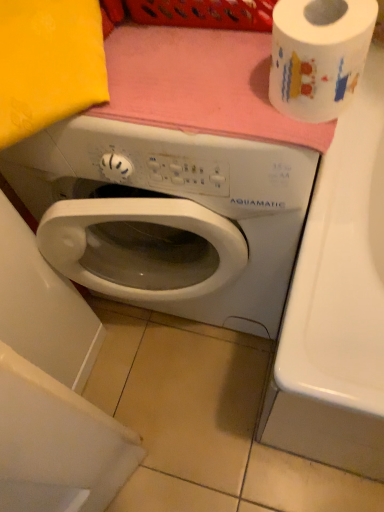
In order to face white glossy washing machine at center, should I rotate leftwards or rightwards?

Turn left by 0.964 degrees to look at white glossy washing machine at center.

This screenshot has width=384, height=512. What do you see at coordinates (167, 216) in the screenshot? I see `white glossy washing machine at center` at bounding box center [167, 216].

Measure the distance between white glossy washing machine at center and camera.

The depth of white glossy washing machine at center is 19.02 inches.

You are a GUI agent. You are given a task and a screenshot of the screen. Output one action in this format:
    pyautogui.click(x=<x>, y=<y>)
    Task: Click on the white glossy washing machine at center
    
    Given the screenshot: What is the action you would take?
    [167, 216]

The image size is (384, 512). Identify the location of white glossy toilet paper at upper right. (318, 55).

Image resolution: width=384 pixels, height=512 pixels. What do you see at coordinates (318, 55) in the screenshot?
I see `white glossy toilet paper at upper right` at bounding box center [318, 55].

At what (x,y) coordinates should I click in order to perform the action: click on white glossy washing machine at center. Please return your answer as a coordinate pair (x, y). The image size is (384, 512). Looking at the image, I should click on (167, 216).

Is white glossy washing machine at center to the left of white glossy toilet paper at upper right from the viewer's perspective?

Indeed, white glossy washing machine at center is positioned on the left side of white glossy toilet paper at upper right.

Which object is closer to the camera taking this photo, white glossy washing machine at center or white glossy toilet paper at upper right?

Positioned in front is white glossy toilet paper at upper right.

Does point (291, 256) come in front of point (337, 46)?

No, it is behind (337, 46).

From the image's perspective, between white glossy washing machine at center and white glossy toilet paper at upper right, which one is located above?

white glossy toilet paper at upper right.

From a real-world perspective, is white glossy washing machine at center located higher than white glossy toilet paper at upper right?

No, from a real-world perspective, white glossy washing machine at center is not above white glossy toilet paper at upper right.

Which object is wider, white glossy washing machine at center or white glossy toilet paper at upper right?

With larger width is white glossy washing machine at center.

Considering the relative sizes of white glossy washing machine at center and white glossy toilet paper at upper right in the image provided, is white glossy washing machine at center shorter than white glossy toilet paper at upper right?

No, white glossy washing machine at center is not shorter than white glossy toilet paper at upper right.

Based on their sizes in the image, would you say white glossy washing machine at center is bigger or smaller than white glossy toilet paper at upper right?

In the image, white glossy washing machine at center appears to be larger than white glossy toilet paper at upper right.

Would you say white glossy toilet paper at upper right is part of white glossy washing machine at center's contents?

Definitely not — white glossy toilet paper at upper right is not inside white glossy washing machine at center.

Are white glossy washing machine at center and white glossy toilet paper at upper right making contact?

There is a gap between white glossy washing machine at center and white glossy toilet paper at upper right.

Does white glossy washing machine at center turn towards white glossy toilet paper at upper right?

No.

Consider the image. Can you tell me how much white glossy washing machine at center and white glossy toilet paper at upper right differ in facing direction?

The facing directions of white glossy washing machine at center and white glossy toilet paper at upper right are 0.00164 degrees apart.

Measure the distance from white glossy washing machine at center to white glossy toilet paper at upper right.

white glossy washing machine at center is 32.25 centimeters away from white glossy toilet paper at upper right.

Where is `washing machine below the white glossy toilet paper at upper right (from the image's perspective)`? This screenshot has width=384, height=512. washing machine below the white glossy toilet paper at upper right (from the image's perspective) is located at coordinates (167, 216).

Considering the relative positions of white glossy toilet paper at upper right and white glossy washing machine at center in the image provided, is white glossy toilet paper at upper right to the left or to the right of white glossy washing machine at center?

white glossy toilet paper at upper right is positioned on white glossy washing machine at center's right side.

Is white glossy toilet paper at upper right closer to camera compared to white glossy washing machine at center?

Yes, white glossy toilet paper at upper right is closer to the camera.

Is point (368, 35) less distant than point (54, 152)?

Yes, point (368, 35) is in front of point (54, 152).

From the image's perspective, is white glossy toilet paper at upper right on white glossy washing machine at center?

Yes, from the image's perspective, white glossy toilet paper at upper right is over white glossy washing machine at center.

From a real-world perspective, does white glossy toilet paper at upper right stand above white glossy washing machine at center?

Yes, from a real-world perspective, white glossy toilet paper at upper right is over white glossy washing machine at center

Is white glossy toilet paper at upper right thinner than white glossy washing machine at center?

Yes.

Is white glossy toilet paper at upper right taller or shorter than white glossy washing machine at center?

Clearly, white glossy toilet paper at upper right is shorter compared to white glossy washing machine at center.

Can you confirm if white glossy toilet paper at upper right is bigger than white glossy washing machine at center?

No.

Can we say white glossy toilet paper at upper right lies outside white glossy washing machine at center?

Indeed, white glossy toilet paper at upper right is completely outside white glossy washing machine at center.

Would you say white glossy toilet paper at upper right is a long distance from white glossy washing machine at center?

white glossy toilet paper at upper right is actually quite close to white glossy washing machine at center.

Is white glossy washing machine at center at the back of white glossy toilet paper at upper right?

No, white glossy toilet paper at upper right's orientation is not away from white glossy washing machine at center.

How different are the orientations of white glossy toilet paper at upper right and white glossy washing machine at center in degrees?

The angular difference between white glossy toilet paper at upper right and white glossy washing machine at center is 0.00164 degrees.

This screenshot has height=512, width=384. Identify the location of washing machine below the white glossy toilet paper at upper right (from a real-world perspective). (167, 216).

The image size is (384, 512). I want to click on toilet paper above the white glossy washing machine at center (from the image's perspective), so click(318, 55).

I want to click on washing machine located below the white glossy toilet paper at upper right (from the image's perspective), so click(167, 216).